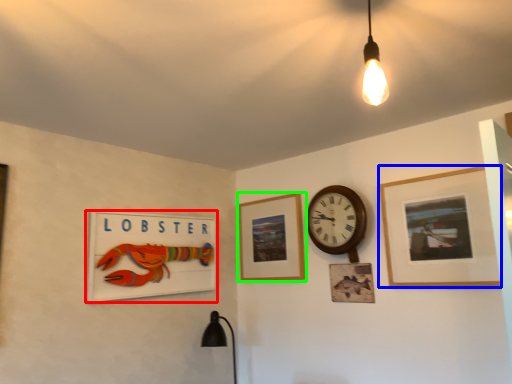
Question: Estimate the real-world distances between objects in this image. Which object is closer to picture frame (highlighted by a red box), picture frame (highlighted by a blue box) or picture frame (highlighted by a green box)?

Choices:
 (A) picture frame
 (B) picture frame

Answer: (B)